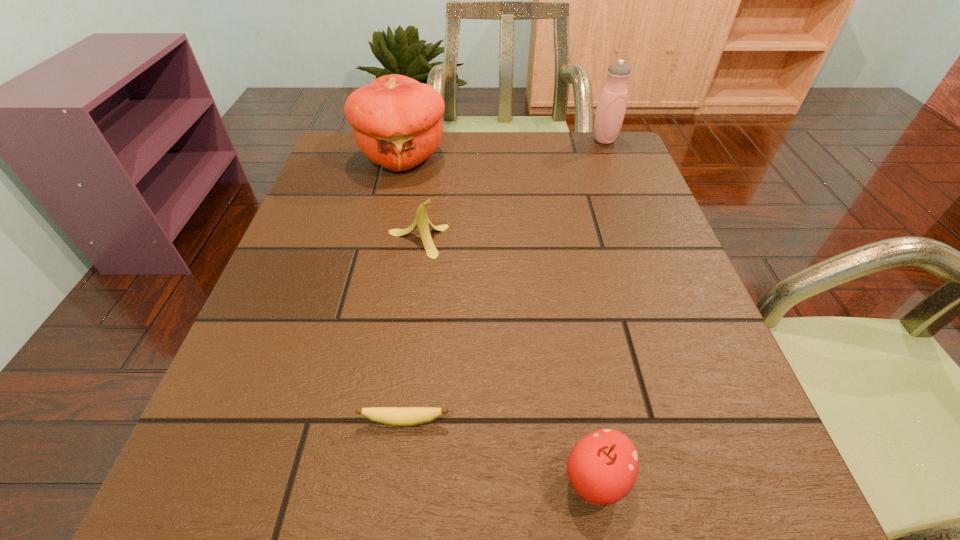
Locate an element on the screen. The height and width of the screenshot is (540, 960). blank space located on the right of the taller banana is located at coordinates (542, 241).

The height and width of the screenshot is (540, 960). Identify the location of free location located 0.350m on the back of the nearest object. (559, 268).

Find the location of a particular element. free spot located 0.210m on the right of the nearer banana is located at coordinates (595, 421).

I want to click on thermos bottle that is positioned at the far edge, so click(x=611, y=107).

Where is `pumpkin located at the far edge`? This screenshot has width=960, height=540. pumpkin located at the far edge is located at coordinates (396, 120).

Where is `object positioned at the near edge`? The width and height of the screenshot is (960, 540). object positioned at the near edge is located at coordinates (602, 467).

Identify the location of object situated at the left edge. The height and width of the screenshot is (540, 960). (396, 120).

The height and width of the screenshot is (540, 960). What are the coordinates of `object at the right edge` in the screenshot? It's located at (611, 107).

I want to click on object present at the far left corner, so click(x=396, y=120).

I want to click on object located in the far right corner section of the desktop, so click(x=611, y=107).